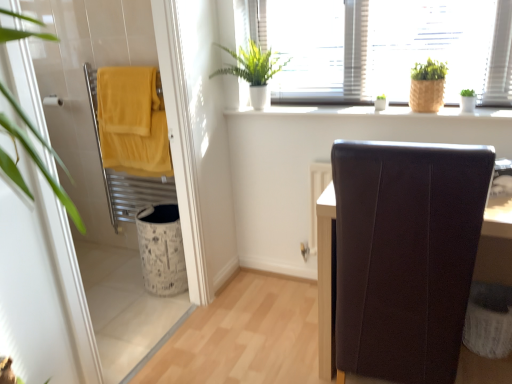
Question: In the image, is white ceramic window sill at upper center on the left side or the right side of matte yellow towel at left?

Choices:
 (A) left
 (B) right

Answer: (B)

Question: Do you think white ceramic window sill at upper center is within matte yellow towel at left, or outside of it?

Choices:
 (A) inside
 (B) outside

Answer: (B)

Question: Estimate the real-world distances between objects in this image. Which object is closer to the white ceramic window sill at upper center?

Choices:
 (A) brown leather chair at right
 (B) green leafy plant at upper center, the first houseplant from the left
 (C) white textured laundry basket at lower right
 (D) green matte plant at upper right, which is the 3th houseplant in left-to-right order
 (E) bamboo textured pot at upper right, the second houseplant viewed from the left

Answer: (E)

Question: Which is nearer to the white ceramic window sill at upper center?

Choices:
 (A) green leafy plant at upper center, the first houseplant from the left
 (B) brown leather chair at right
 (C) white textured laundry basket at lower right
 (D) green matte plant at upper right, which is the 3th houseplant in left-to-right order
 (E) bamboo textured pot at upper right, the second houseplant viewed from the left

Answer: (E)